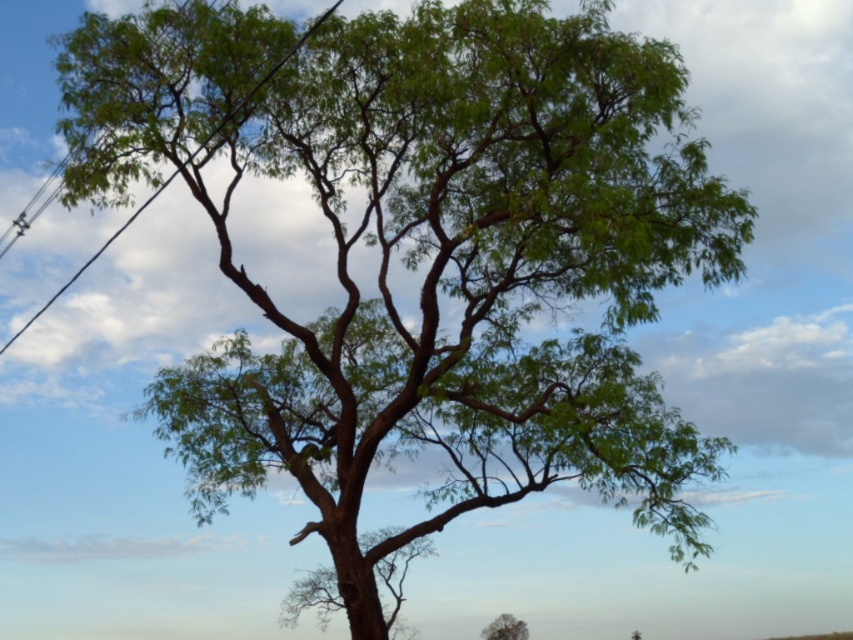
You are an artist planning to paint the scene. You want to ensure the black wire at upper left and the green leafy tree at center are proportionally accurate. Which object should you draw wider in your painting?

The black wire at upper left should be drawn wider than the green leafy tree at center because its width surpasses that of the tree according to the description.

You are a bird looking for a place to perch. You see a black wire at upper left and a green leafy tree at center. Which one is higher up in the sky?

The black wire at upper left is above the green leafy tree at center, so it is higher up in the sky.